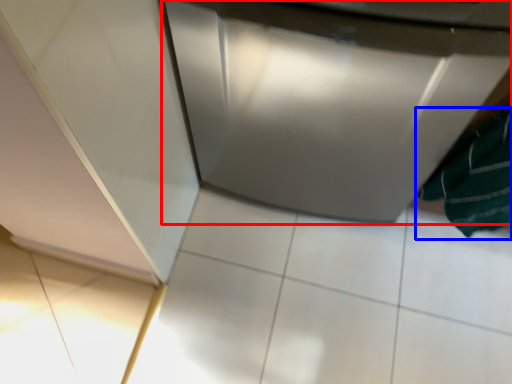
Question: Which object is closer to the camera taking this photo, home appliance (highlighted by a red box) or bath towel (highlighted by a blue box)?

Choices:
 (A) home appliance
 (B) bath towel

Answer: (B)